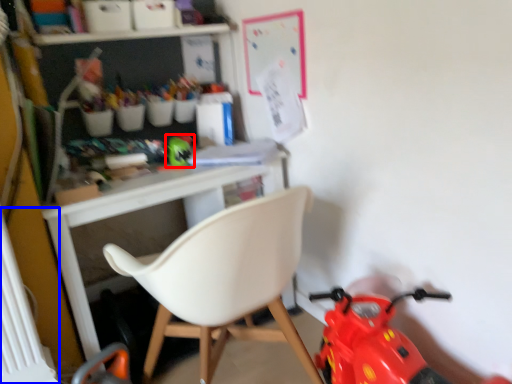
Question: Which object is further to the camera taking this photo, toy (highlighted by a red box) or radiator (highlighted by a blue box)?

Choices:
 (A) toy
 (B) radiator

Answer: (A)